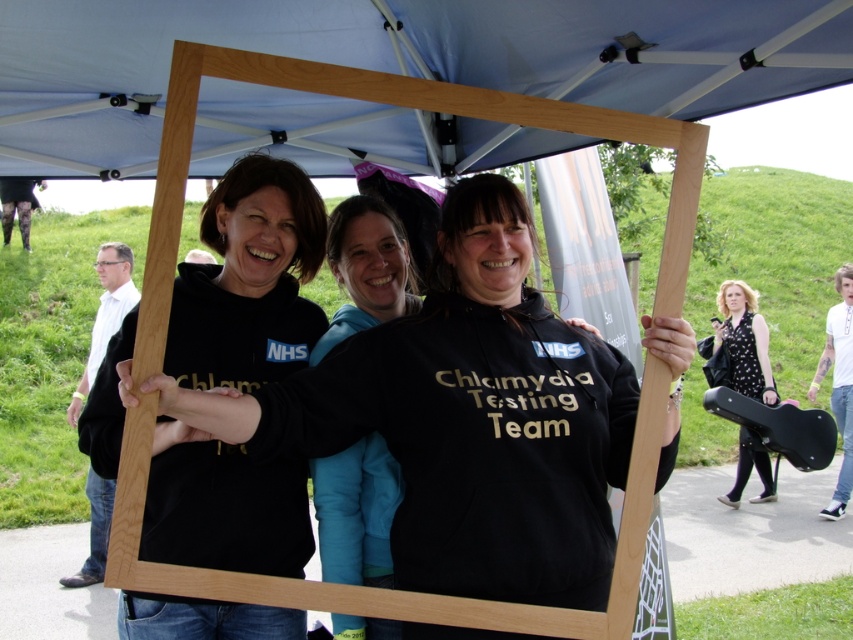
You are a photographer trying to capture a clear shot of both the black matte sweatshirt at center and the black fleece at center. Since they are both positioned at the center, which one is blocking the other from view?

The black matte sweatshirt at center is in front of the black fleece at center, so it is blocking the view of the black fleece at center.